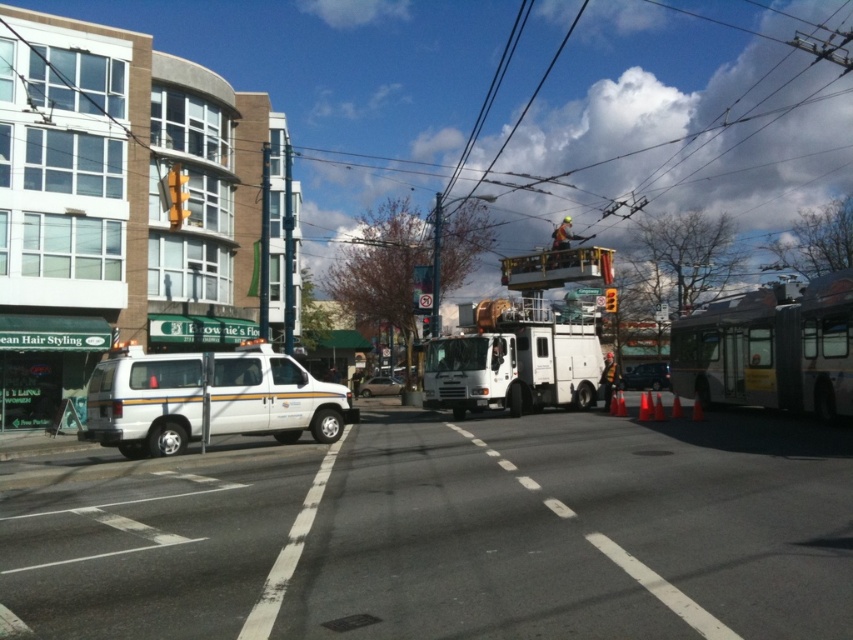
You are a delivery driver approaching the intersection shown in the image. You see the white utility truck at center and the yellow matte traffic light at upper center. Which object is bigger in the image?

The white utility truck at center is larger in size compared to the yellow matte traffic light at upper center.

You are a delivery driver approaching the road with a white van parked on the left and a utility truck near the center. You notice two points marked on the road ahead at coordinates point (386,385) and point (428,326). Which point is closer to your current position?

Point (428,326) is closer to your current position because it is less further to the camera than point (386,385).

You are a delivery driver approaching the intersection. You need to pass through the area where the white utility truck at center and the metallic traffic light at center are located. Can your standard delivery van, which is 2.5 meters wide, safely navigate between them without touching either?

The white utility truck at center might be wider than metallic traffic light at center. Since the utility truck is wider, there might not be enough space for the 2.5 meter wide delivery van to pass safely between them. It is recommended to choose an alternate route or check the exact dimensions before proceeding.